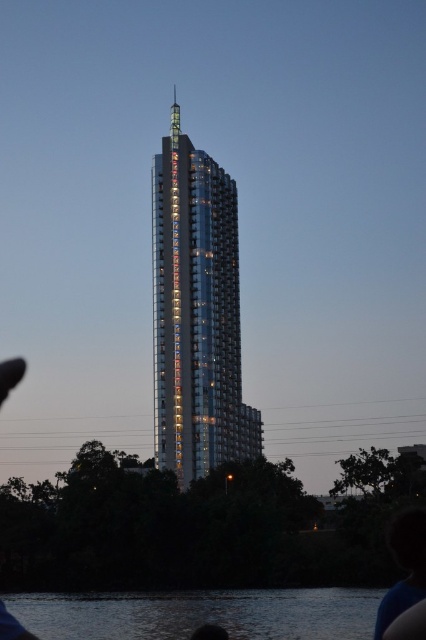
You are standing on the sidewalk facing the shiny metallic building at center and the dark water at lower center. Which object is closer to your right side?

The shiny metallic building at center is to the right of dark water at lower center, so the shiny metallic building at center is closer to your right side.

You are standing on the edge of a dock and see the shiny metallic building at center and the dark water at lower center. Which object is closer to you?

The dark water at lower center is closer to you because it is positioned below the shiny metallic building at center.

You are standing at a viewpoint 200 meters away from the shiny metallic building at center. Can you safely approach the building without exceeding the 200 meter limit?

The shiny metallic building at center and camera are 229.07 meters apart, which is beyond the 200 meter limit. Therefore, you cannot safely approach the building without exceeding the limit.